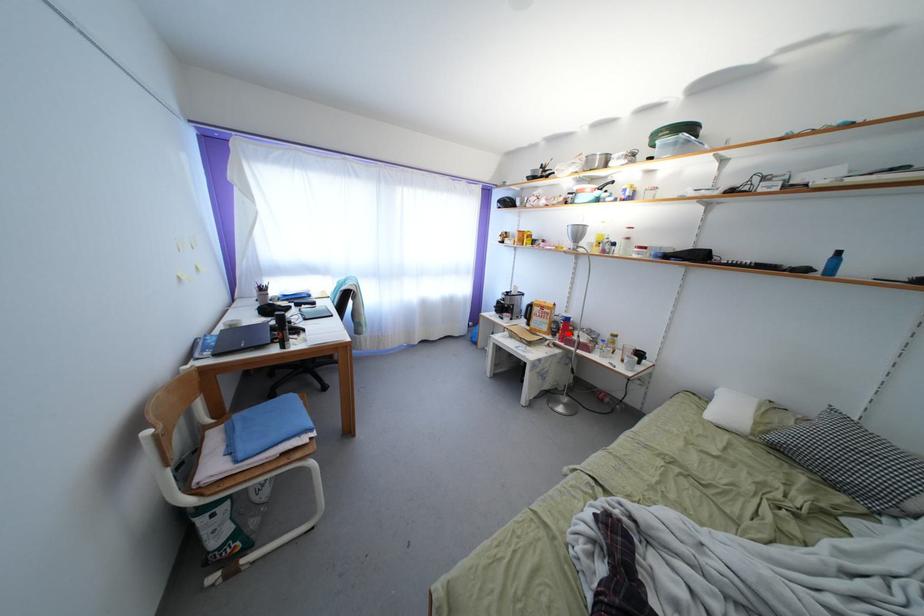
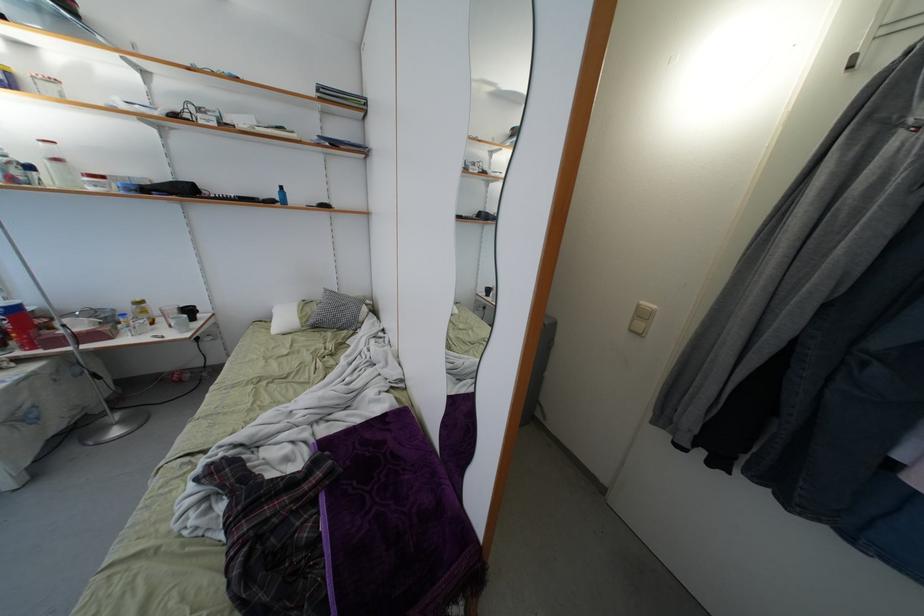
Question: I am providing you with two images of the same scene from different viewpoints. A red point is shown in image1. For the corresponding object point in image2, is it positioned nearer or farther from the camera?

Choices:
 (A) Nearer
 (B) Farther

Answer: (B)